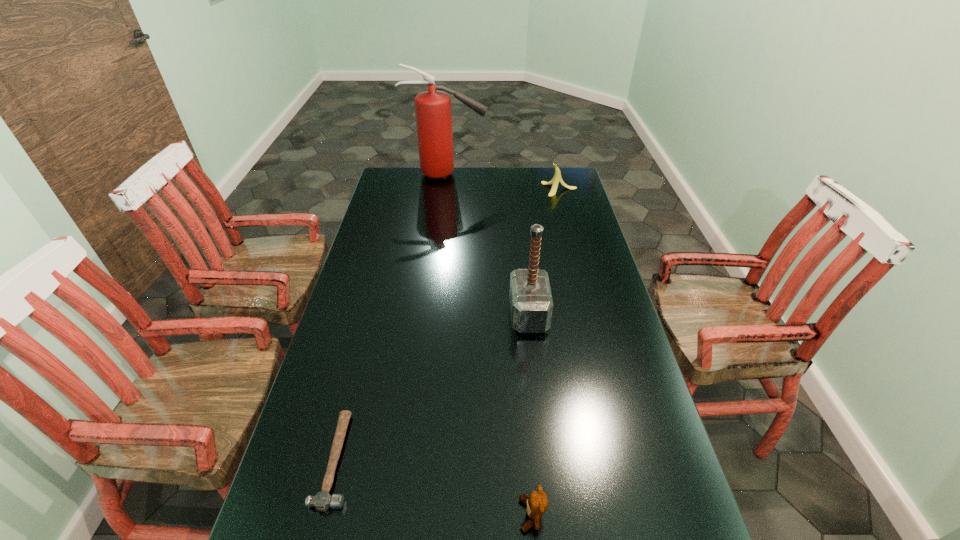
At what (x,y) coordinates should I click in order to perform the action: click on free space that satisfies the following two spatial constraints: 1. on the back side of the banana; 2. on the right side of the fourth shortest object. Please return your answer as a coordinate pair (x, y). Looking at the image, I should click on (515, 189).

Where is `vacant region that satisfies the following two spatial constraints: 1. at the nozzle of the third farthest object; 2. on the right side of the tallest object`? vacant region that satisfies the following two spatial constraints: 1. at the nozzle of the third farthest object; 2. on the right side of the tallest object is located at coordinates (430, 315).